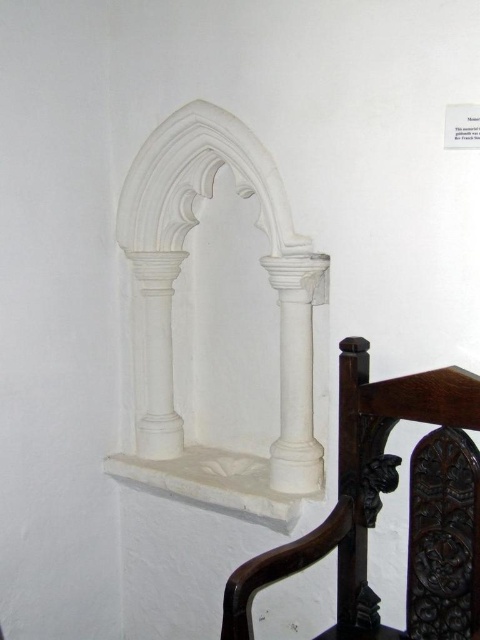
Question: Is brown carved wood chair at lower right smaller than white marble column at center?

Choices:
 (A) yes
 (B) no

Answer: (B)

Question: Can you confirm if brown carved wood chair at lower right is wider than white marble column at center?

Choices:
 (A) no
 (B) yes

Answer: (B)

Question: Which of the following is the farthest from the observer?

Choices:
 (A) (297, 339)
 (B) (312, 556)

Answer: (A)

Question: Can you confirm if brown carved wood chair at lower right is smaller than white marble column at center?

Choices:
 (A) no
 (B) yes

Answer: (A)

Question: Among these objects, which one is nearest to the camera?

Choices:
 (A) brown carved wood chair at lower right
 (B) white marble column at center

Answer: (A)